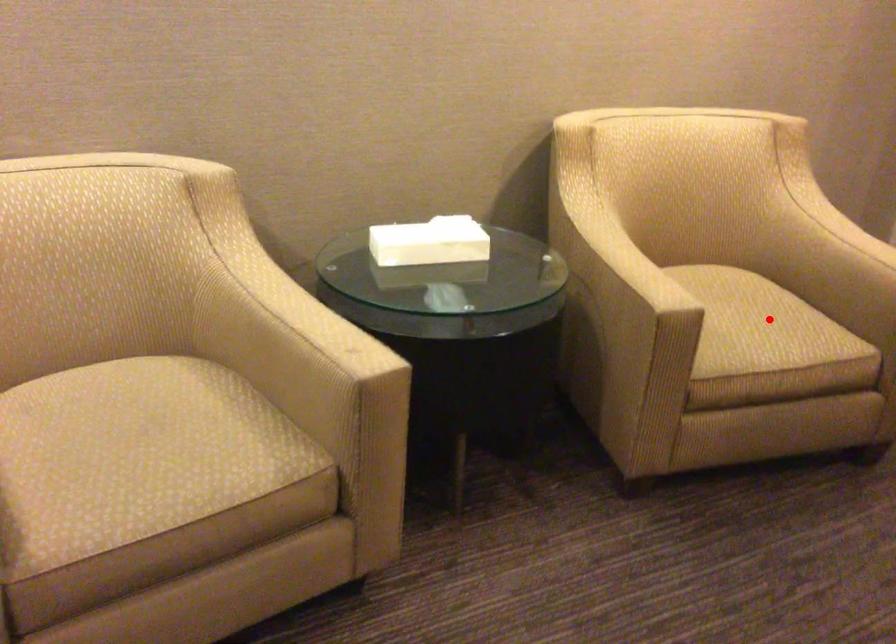
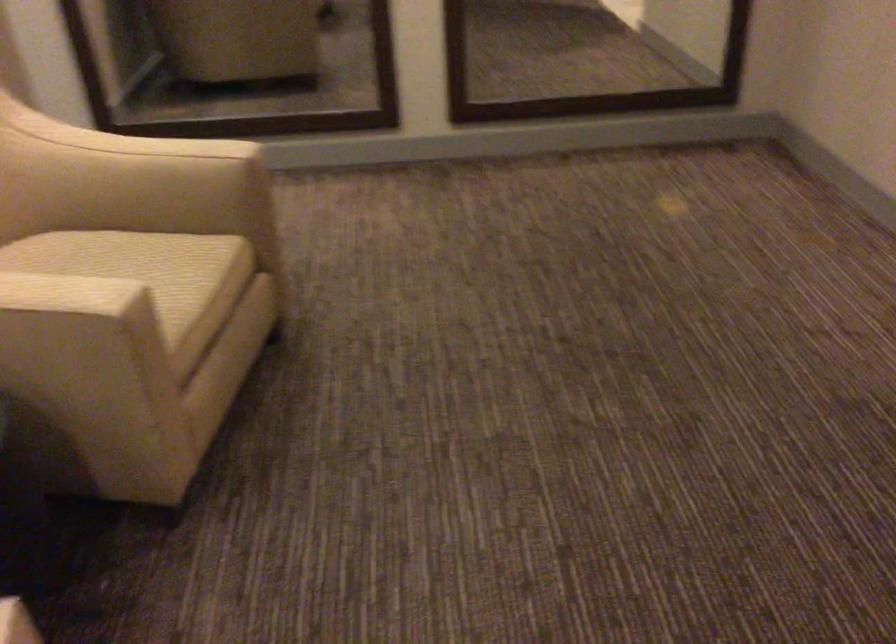
Question: I am providing you with two images of the same scene from different viewpoints. Image1 has a red point marked. In image2, the corresponding 3D location appears at what relative position? Reply with the corresponding letter.

Choices:
 (A) Closer
 (B) Farther

Answer: (A)